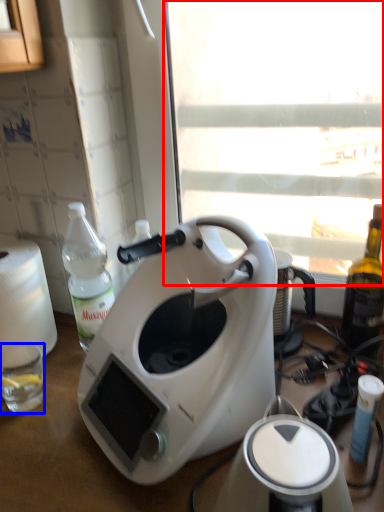
Question: Which object is further to the camera taking this photo, window screen (highlighted by a red box) or coffee cup (highlighted by a blue box)?

Choices:
 (A) window screen
 (B) coffee cup

Answer: (B)